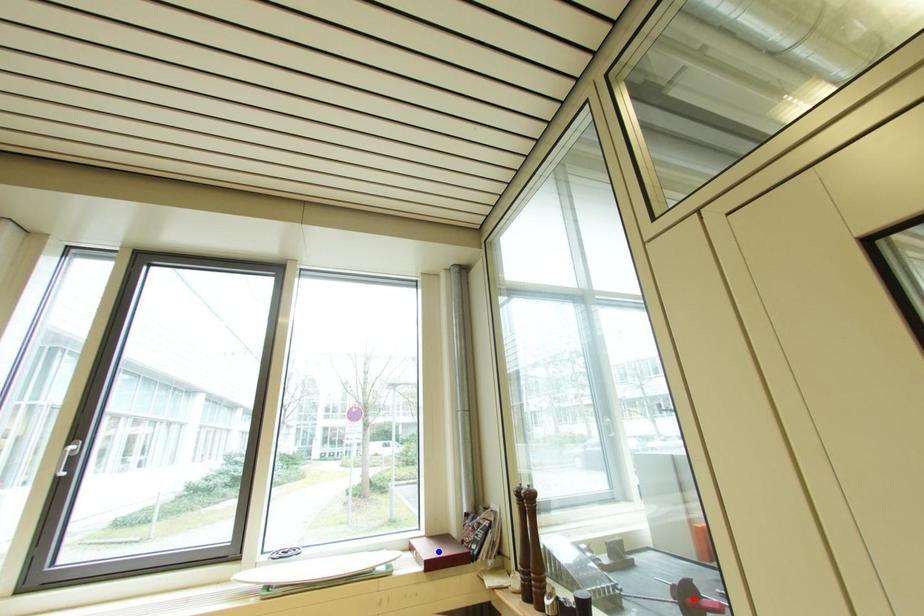
Question: Which of the two points in the image is closer to the camera?

Choices:
 (A) Blue point is closer.
 (B) Red point is closer.

Answer: (B)